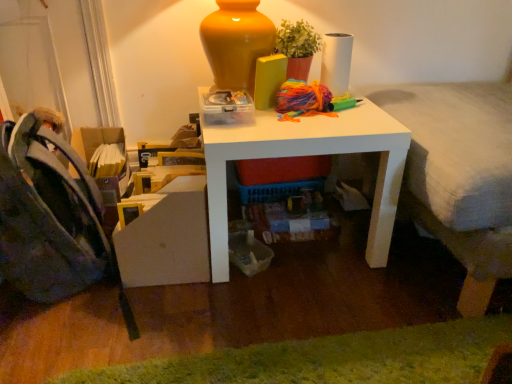
Identify the location of vacant space in front of white matte table at center. (275, 309).